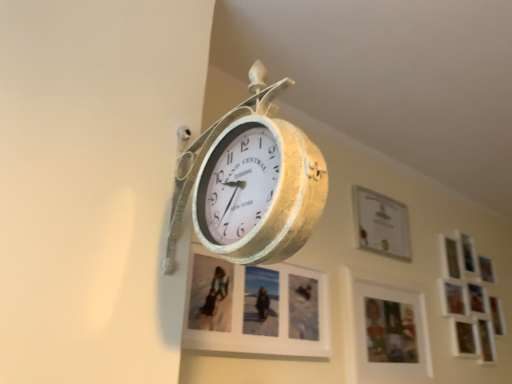
Question: Is wooden photo frame at lower right, which is the 2th picture frame from left to right, not inside matte white picture frame at center, the 1th picture frame viewed from the left?

Choices:
 (A) yes
 (B) no

Answer: (A)

Question: Is wooden photo frame at lower right, which is the 2th picture frame from left to right, shorter than matte white picture frame at center, the fourth picture frame viewed from the right?

Choices:
 (A) no
 (B) yes

Answer: (A)

Question: Can matte white picture frame at center, the fourth picture frame viewed from the right, be found inside wooden photo frame at lower right, which is the 2th picture frame from left to right?

Choices:
 (A) no
 (B) yes

Answer: (A)

Question: From the image's perspective, would you say wooden photo frame at lower right, which is the 2th picture frame from left to right, is positioned over matte white picture frame at center, the fourth picture frame viewed from the right?

Choices:
 (A) yes
 (B) no

Answer: (B)

Question: Can you confirm if wooden photo frame at lower right, which is the 2th picture frame from left to right, is taller than matte white picture frame at center, the fourth picture frame viewed from the right?

Choices:
 (A) yes
 (B) no

Answer: (A)

Question: From a real-world perspective, is wooden photo frame at lower right, which is the 2th picture frame from left to right, positioned above or below white matte picture frame at upper right, arranged as the fourth picture frame when viewed from the left?

Choices:
 (A) above
 (B) below

Answer: (B)

Question: Is point (402, 317) positioned closer to the camera than point (441, 281)?

Choices:
 (A) farther
 (B) closer

Answer: (B)

Question: Looking at the image, does wooden photo frame at lower right, which is the 2th picture frame from left to right, seem bigger or smaller compared to white matte picture frame at upper right, the first picture frame when ordered from right to left?

Choices:
 (A) big
 (B) small

Answer: (B)

Question: From the image's perspective, is wooden photo frame at lower right, which is the 2th picture frame from left to right, positioned above or below white matte picture frame at upper right, the first picture frame when ordered from right to left?

Choices:
 (A) below
 (B) above

Answer: (A)

Question: From their relative heights in the image, would you say white matte picture frame at upper right, the first picture frame when ordered from right to left, is taller or shorter than gold textured clock at center?

Choices:
 (A) short
 (B) tall

Answer: (B)

Question: Is white matte picture frame at upper right, the first picture frame when ordered from right to left, situated inside gold textured clock at center or outside?

Choices:
 (A) outside
 (B) inside

Answer: (A)

Question: From the image's perspective, relative to gold textured clock at center, is white matte picture frame at upper right, arranged as the fourth picture frame when viewed from the left, above or below?

Choices:
 (A) above
 (B) below

Answer: (B)

Question: In the image, is white matte picture frame at upper right, the first picture frame when ordered from right to left, positioned in front of or behind gold textured clock at center?

Choices:
 (A) behind
 (B) front

Answer: (A)

Question: In terms of width, does matte white picture frame at center, the 1th picture frame viewed from the left, look wider or thinner when compared to wooden photo frame at lower right, marked as the 3th picture frame in a right-to-left arrangement?

Choices:
 (A) wide
 (B) thin

Answer: (A)

Question: From the image's perspective, is matte white picture frame at center, the 1th picture frame viewed from the left, located above or below wooden photo frame at lower right, which is the 2th picture frame from left to right?

Choices:
 (A) below
 (B) above

Answer: (B)